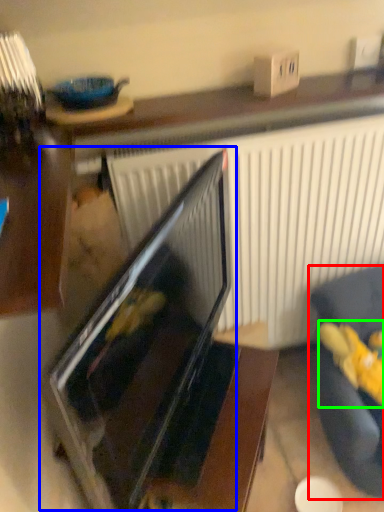
Question: Which object is the farthest from furniture (highlighted by a red box)? Choose among these: oven (highlighted by a blue box) or stuff (highlighted by a green box).

Choices:
 (A) oven
 (B) stuff

Answer: (A)